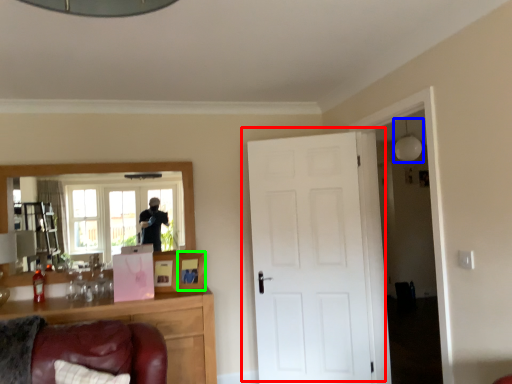
Question: Which object is the farthest from door (highlighted by a red box)? Choose among these: light fixture (highlighted by a blue box) or picture frame (highlighted by a green box).

Choices:
 (A) light fixture
 (B) picture frame

Answer: (A)